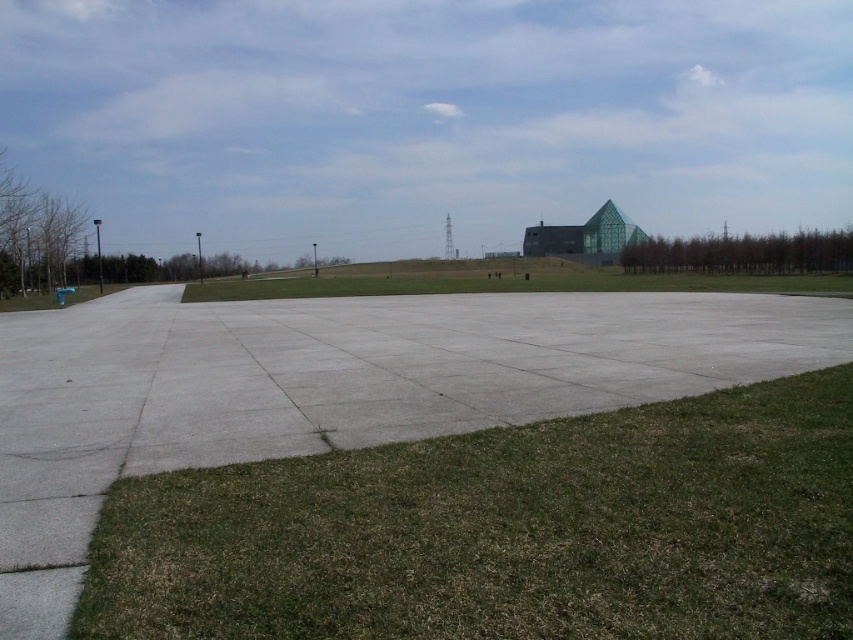
Which is more to the right, green grass at lower right or green grass at center?

From the viewer's perspective, green grass at lower right appears more on the right side.

Does green grass at lower right have a greater width compared to green grass at center?

No, green grass at lower right is not wider than green grass at center.

At what (x,y) coordinates should I click in order to perform the action: click on green grass at lower right. Please return your answer as a coordinate pair (x, y). The height and width of the screenshot is (640, 853). Looking at the image, I should click on (505, 531).